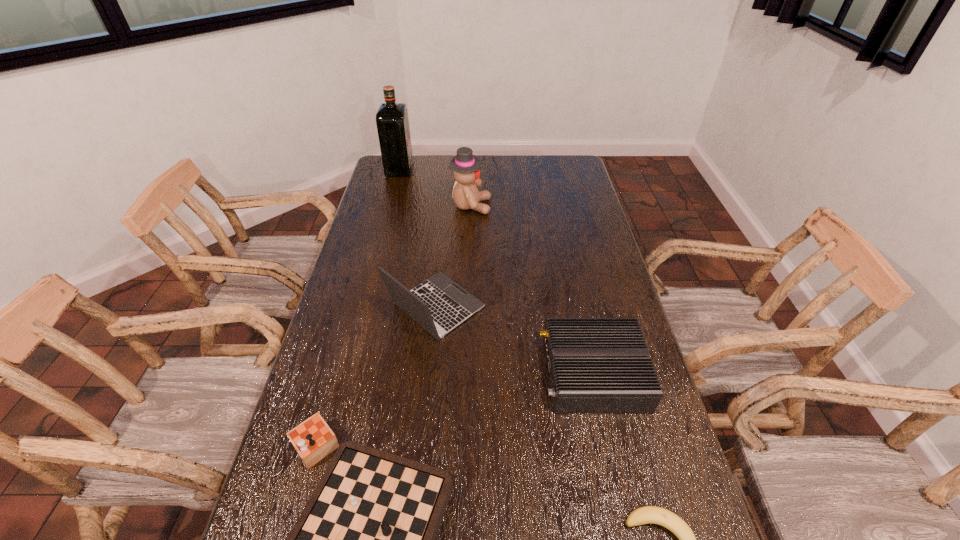
Where is `free region located on the back panel of the router`? The height and width of the screenshot is (540, 960). free region located on the back panel of the router is located at coordinates (491, 373).

You are a GUI agent. You are given a task and a screenshot of the screen. Output one action in this format:
    pyautogui.click(x=<x>, y=<y>)
    Task: Click on the free location located on the back panel of the router
    This screenshot has width=960, height=540.
    Given the screenshot: What is the action you would take?
    pyautogui.click(x=458, y=373)

Locate an element on the screen. object present at the far edge is located at coordinates (392, 121).

This screenshot has width=960, height=540. I want to click on object positioned at the left edge, so click(392, 121).

Where is `object present at the right edge`? The width and height of the screenshot is (960, 540). object present at the right edge is located at coordinates (596, 365).

I want to click on object that is at the far left corner, so click(392, 121).

Image resolution: width=960 pixels, height=540 pixels. Identify the location of vacant space at the far edge of the desktop. (432, 177).

The height and width of the screenshot is (540, 960). In the image, there is a desktop. What are the coordinates of `blank space at the left edge` in the screenshot? It's located at (358, 318).

This screenshot has height=540, width=960. Find the location of `free point at the right edge`. free point at the right edge is located at coordinates (567, 268).

The image size is (960, 540). Identify the location of free point between the laptop_computer and the tallest object. (418, 238).